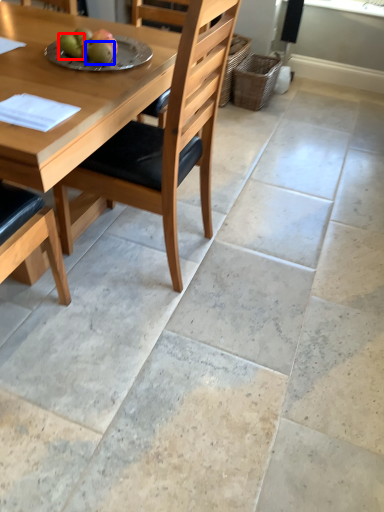
Question: Which object appears farthest to the camera in this image, fruit (highlighted by a red box) or fruit (highlighted by a blue box)?

Choices:
 (A) fruit
 (B) fruit

Answer: (A)